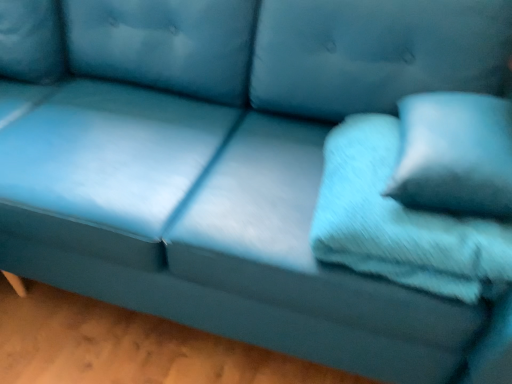
Question: Is soft blue fabric pillow at right, which is the second pillow in left-to-right order, taller or shorter than soft blue fabric pillow at right, the 1th pillow viewed from the left?

Choices:
 (A) short
 (B) tall

Answer: (B)

Question: Relative to soft blue fabric pillow at right, acting as the 2th pillow starting from the right, is soft blue fabric pillow at right, which is the second pillow in left-to-right order, in front or behind?

Choices:
 (A) front
 (B) behind

Answer: (A)

Question: Choose the correct answer: Is soft blue fabric pillow at right, the 1th pillow viewed from the right, inside soft blue fabric pillow at right, the 1th pillow viewed from the left, or outside it?

Choices:
 (A) outside
 (B) inside

Answer: (A)

Question: In the image, is soft blue fabric pillow at right, acting as the 2th pillow starting from the right, positioned in front of or behind soft blue fabric pillow at right, the 1th pillow viewed from the right?

Choices:
 (A) behind
 (B) front

Answer: (A)

Question: In terms of height, does soft blue fabric pillow at right, the 1th pillow viewed from the left, look taller or shorter compared to soft blue fabric pillow at right, the 1th pillow viewed from the right?

Choices:
 (A) tall
 (B) short

Answer: (B)

Question: From a real-world perspective, relative to soft blue fabric pillow at right, the 1th pillow viewed from the right, is soft blue fabric pillow at right, the 1th pillow viewed from the left, vertically above or below?

Choices:
 (A) above
 (B) below

Answer: (B)

Question: In terms of width, does soft blue fabric pillow at right, the 1th pillow viewed from the left, look wider or thinner when compared to soft blue fabric pillow at right, which is the second pillow in left-to-right order?

Choices:
 (A) thin
 (B) wide

Answer: (B)